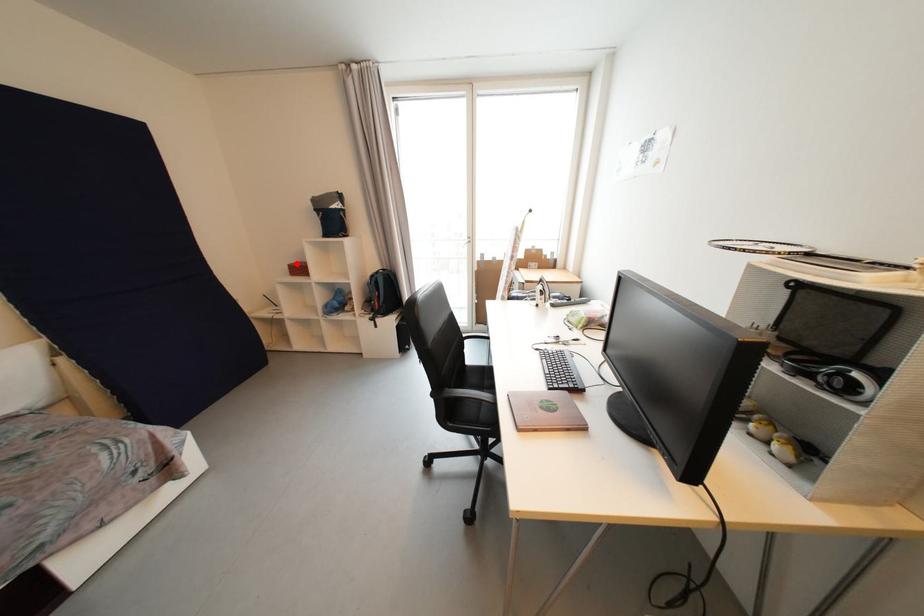
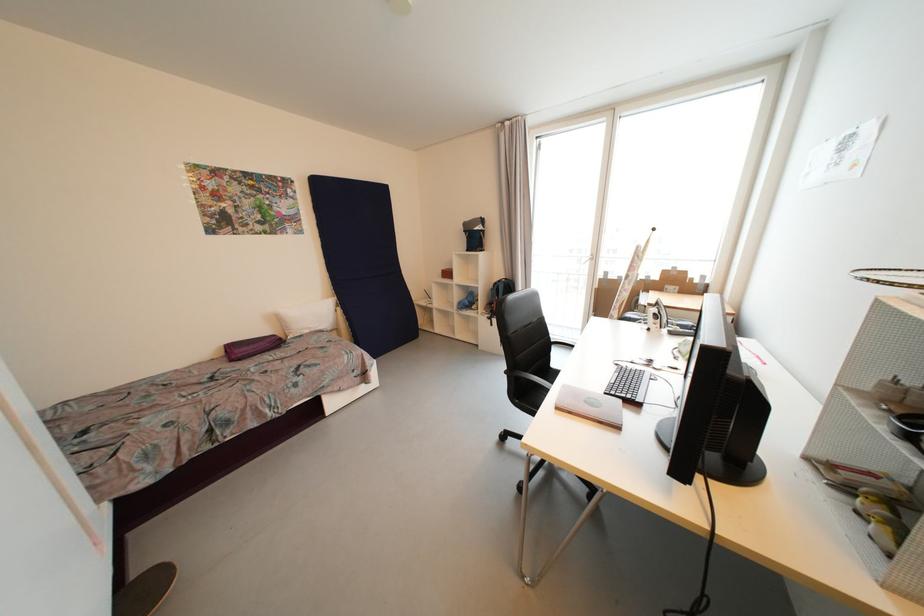
The point at the highlighted location is marked in the first image. Where is the corresponding point in the second image?

(450, 270)